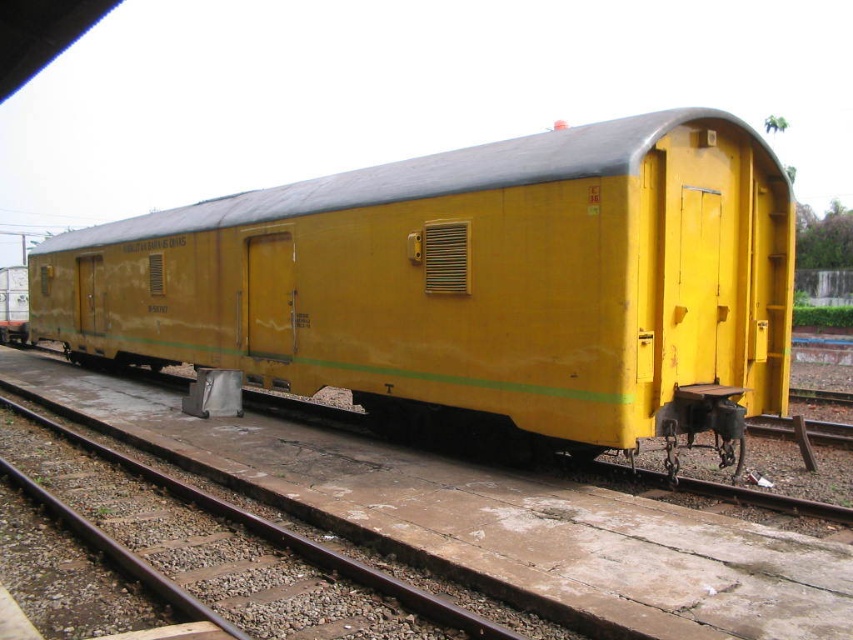
Question: Is yellow matte train car at center positioned before brown metal train track at lower left?

Choices:
 (A) yes
 (B) no

Answer: (B)

Question: Among these points, which one is farthest from the camera?

Choices:
 (A) (428, 321)
 (B) (277, 540)

Answer: (A)

Question: Is yellow matte train car at center further to the viewer compared to brown metal train track at lower left?

Choices:
 (A) yes
 (B) no

Answer: (A)

Question: Is yellow matte train car at center to the right of brown metal train track at lower left from the viewer's perspective?

Choices:
 (A) no
 (B) yes

Answer: (A)